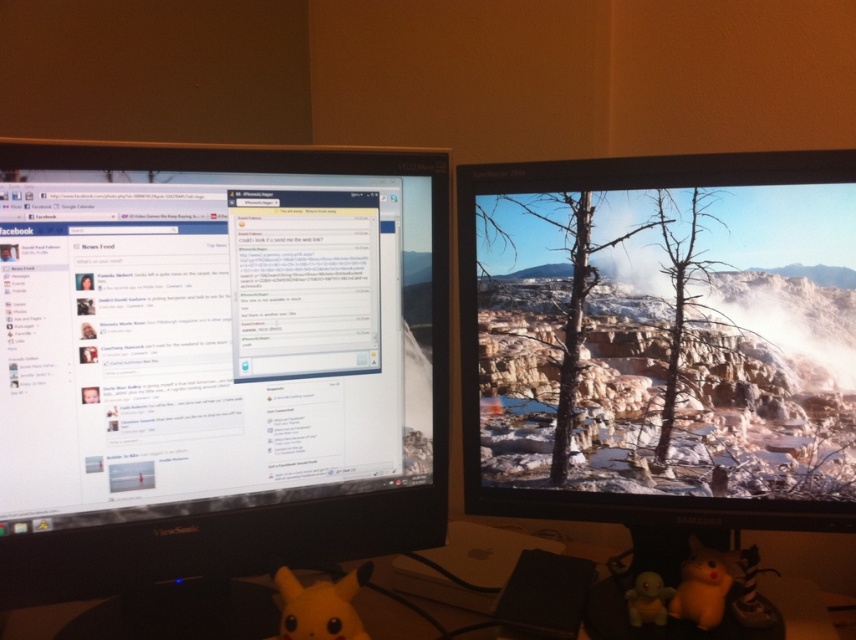
Is black glossy monitor at left taller than matte yellow plush at lower center?

Indeed, black glossy monitor at left has a greater height compared to matte yellow plush at lower center.

What do you see at coordinates (217, 360) in the screenshot?
I see `black glossy monitor at left` at bounding box center [217, 360].

The height and width of the screenshot is (640, 856). I want to click on black glossy monitor at left, so click(217, 360).

Is black plastic table at lower center wider than matte yellow rubber duck at lower right?

Yes, black plastic table at lower center is wider than matte yellow rubber duck at lower right.

Does black plastic table at lower center have a greater height compared to matte yellow rubber duck at lower right?

Indeed, black plastic table at lower center has a greater height compared to matte yellow rubber duck at lower right.

The image size is (856, 640). Identify the location of black plastic table at lower center. (811, 560).

In order to click on black plastic table at lower center in this screenshot , I will do `click(811, 560)`.

Does yellow plush toy at lower right have a larger size compared to matte yellow rubber duck at lower right?

Yes.

The image size is (856, 640). Identify the location of yellow plush toy at lower right. (x=703, y=584).

What are the coordinates of `yellow plush toy at lower right` in the screenshot? It's located at (703, 584).

Image resolution: width=856 pixels, height=640 pixels. What are the coordinates of `yellow plush toy at lower right` in the screenshot? It's located at click(x=703, y=584).